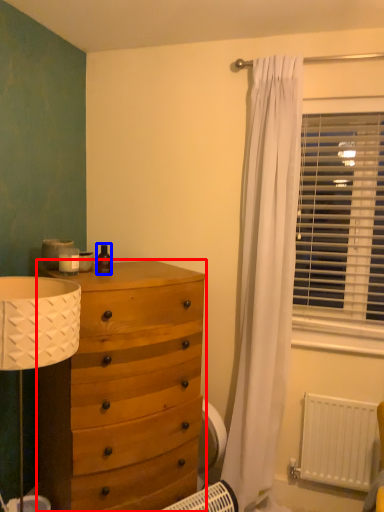
Question: Which object appears closest to the camera in this image, chest of drawers (highlighted by a red box) or toiletry (highlighted by a blue box)?

Choices:
 (A) chest of drawers
 (B) toiletry

Answer: (A)